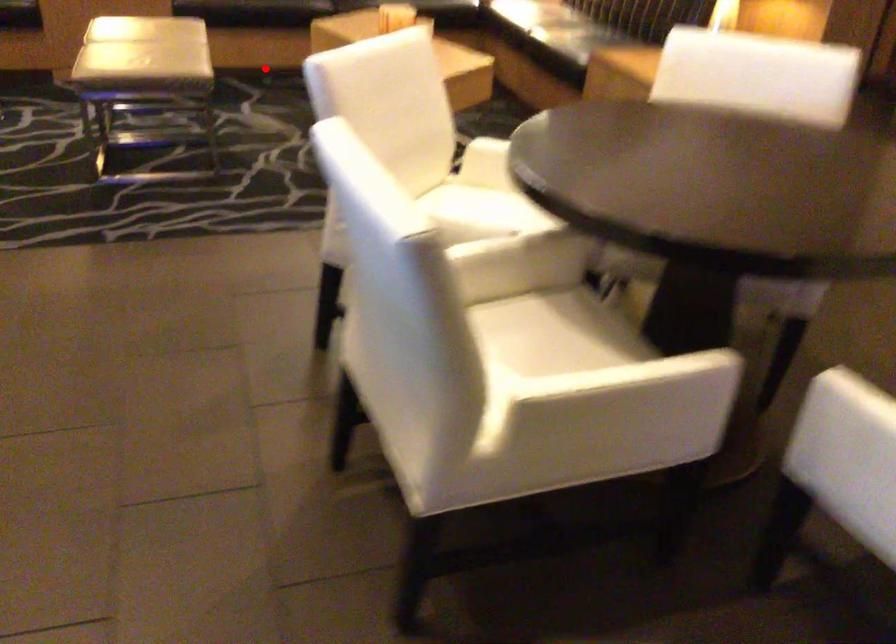
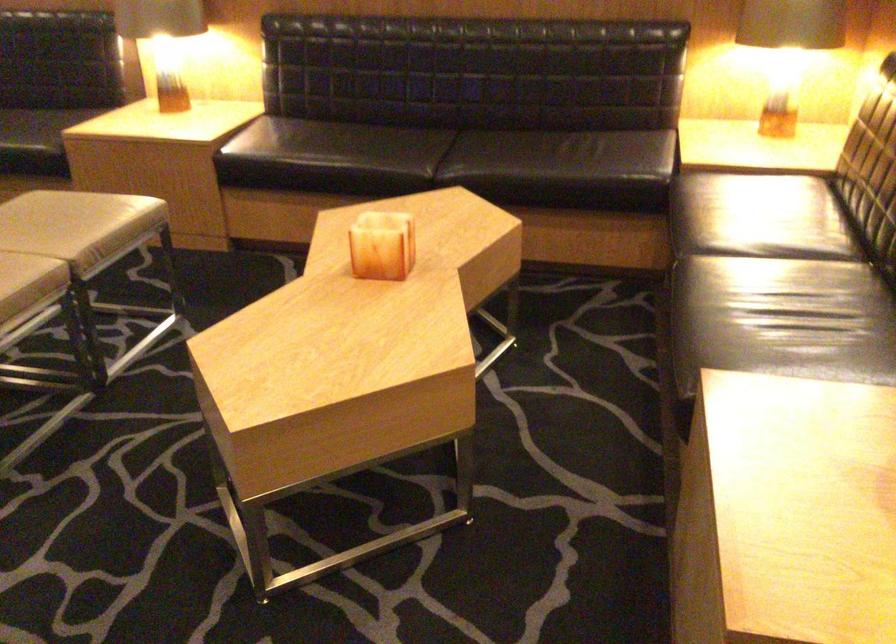
Question: I am providing you with two images of the same scene from different viewpoints. A red point is shown in image1. For the corresponding object point in image2, is it positioned nearer or farther from the camera?

Choices:
 (A) Nearer
 (B) Farther

Answer: (A)